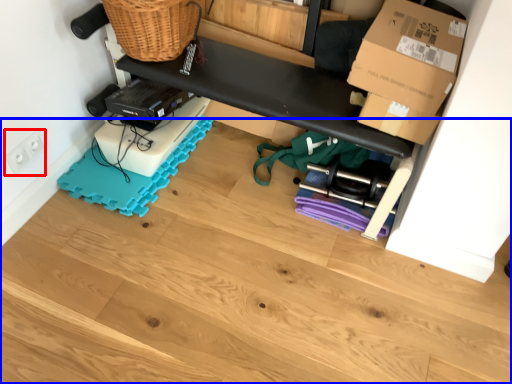
Question: Which object is closer to the camera taking this photo, electric outlet (highlighted by a red box) or wood (highlighted by a blue box)?

Choices:
 (A) electric outlet
 (B) wood

Answer: (B)